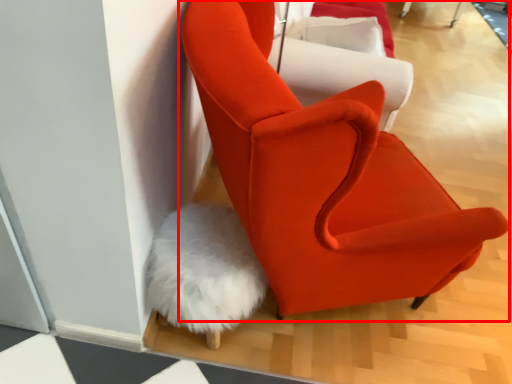
Question: In this image, where is chair (annotated by the red box) located relative to chair?

Choices:
 (A) left
 (B) right

Answer: (A)